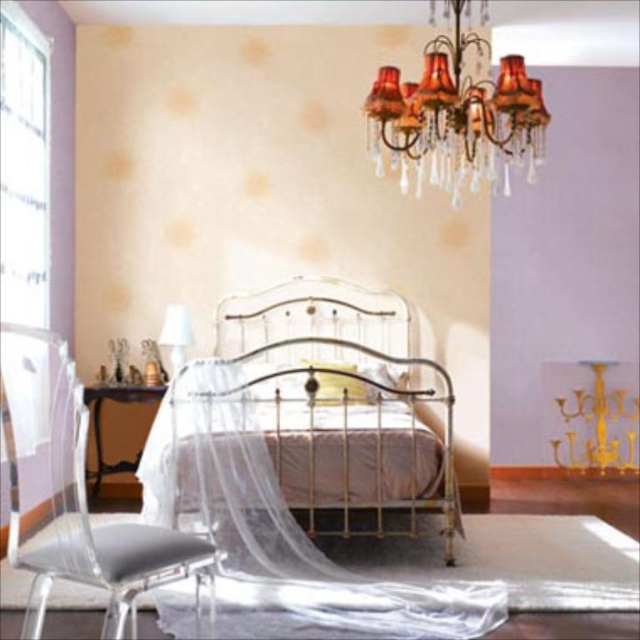
You are standing in the bedroom and notice the orange fabric chandelier at upper center and the white fabric lampshade at center. Which object is positioned higher in the room?

The orange fabric chandelier at upper center is located above the white fabric lampshade at center, so it is positioned higher in the room.

You are an interior designer assessing the lighting in the bedroom. You notice the orange fabric chandelier at upper center and the white fabric lampshade at center. Which of these two lighting fixtures is bigger?

The orange fabric chandelier at upper center is larger in size than the white fabric lampshade at center.